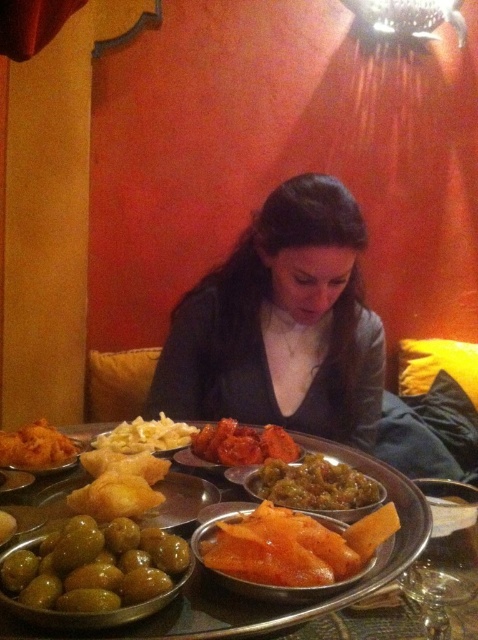
Between point (113, 468) and point (144, 436), which one is positioned behind?

The point (144, 436) is behind.

Does golden fried pastry at center come in front of white creamy pasta at center?

Yes, golden fried pastry at center is closer to the viewer.

Is point (117, 515) closer to viewer compared to point (175, 435)?

Yes, point (117, 515) is closer to viewer.

Image resolution: width=478 pixels, height=640 pixels. I want to click on golden fried pastry at center, so click(119, 484).

Does orange matte flatbread at center have a lesser width compared to golden fried pastry at center?

In fact, orange matte flatbread at center might be wider than golden fried pastry at center.

The height and width of the screenshot is (640, 478). In order to click on orange matte flatbread at center in this screenshot , I will do 293,547.

Find the location of `orange matte flatbread at center`. orange matte flatbread at center is located at coordinates (293, 547).

Does slightly crispy golden-brown chicken at center appear on the right side of matte yellow bread at lower left?

Yes, slightly crispy golden-brown chicken at center is to the right of matte yellow bread at lower left.

This screenshot has height=640, width=478. What are the coordinates of `slightly crispy golden-brown chicken at center` in the screenshot? It's located at (242, 444).